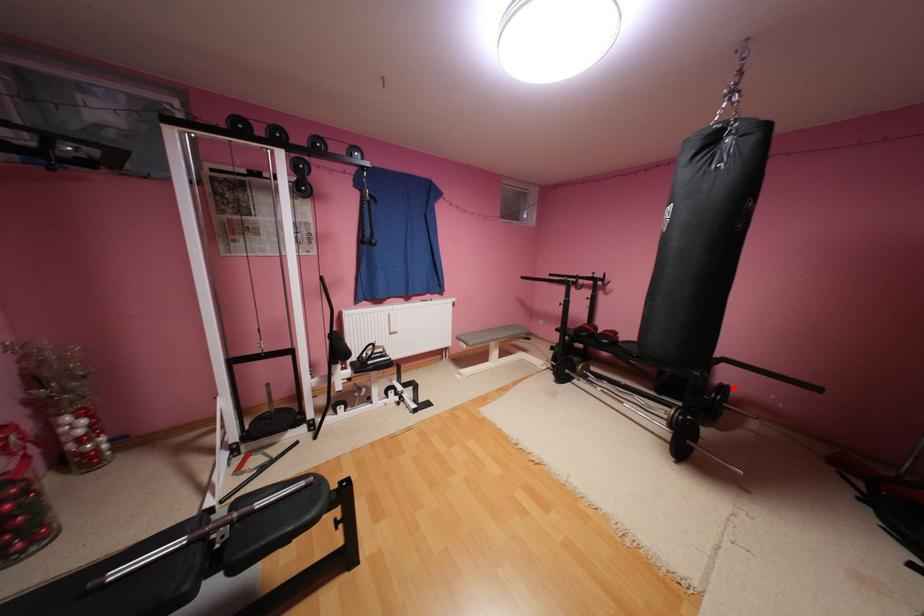
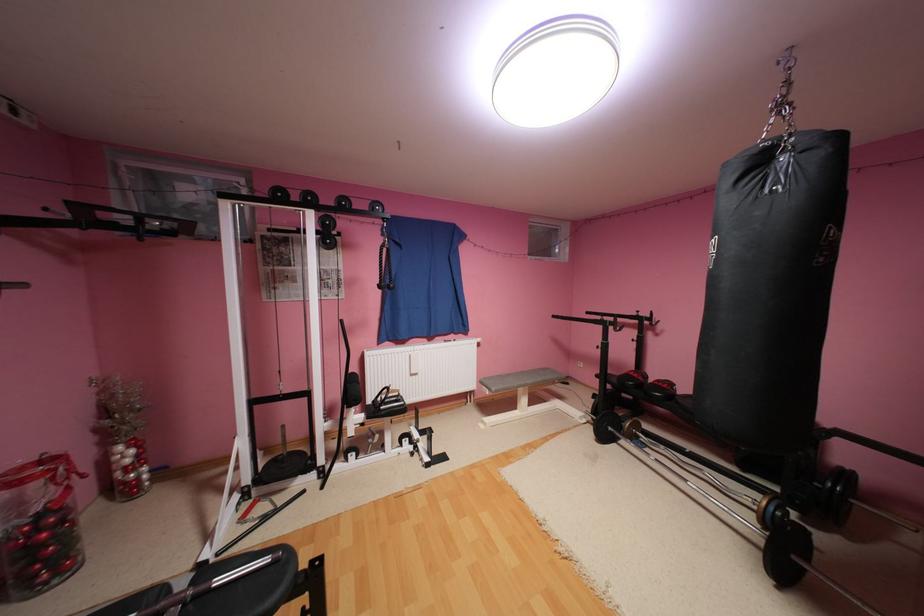
Question: I am providing you with two images of the same scene from different viewpoints. Image1 has a red point marked. In image2, the corresponding 3D location appears at what relative position? Reply with the corresponding letter.

Choices:
 (A) Closer
 (B) Farther

Answer: (B)